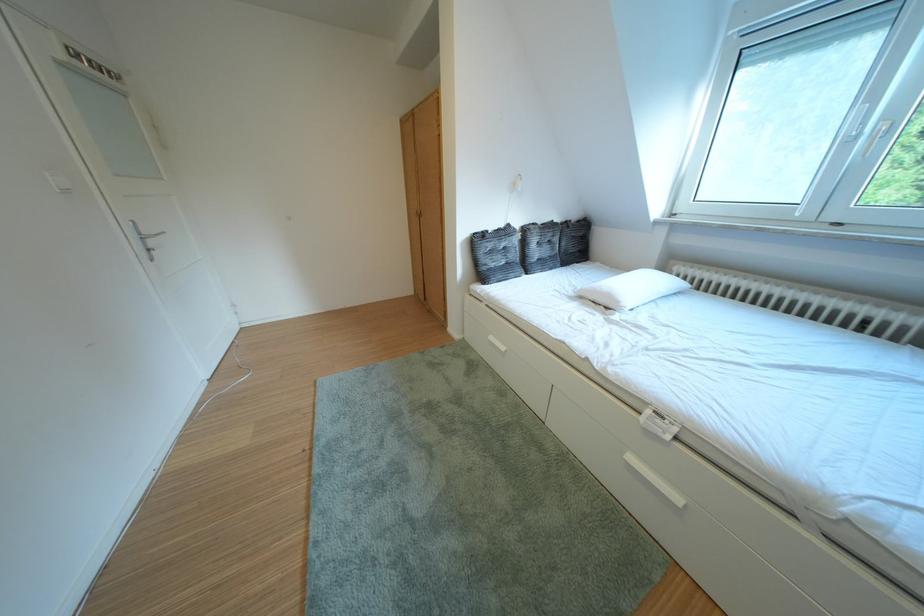
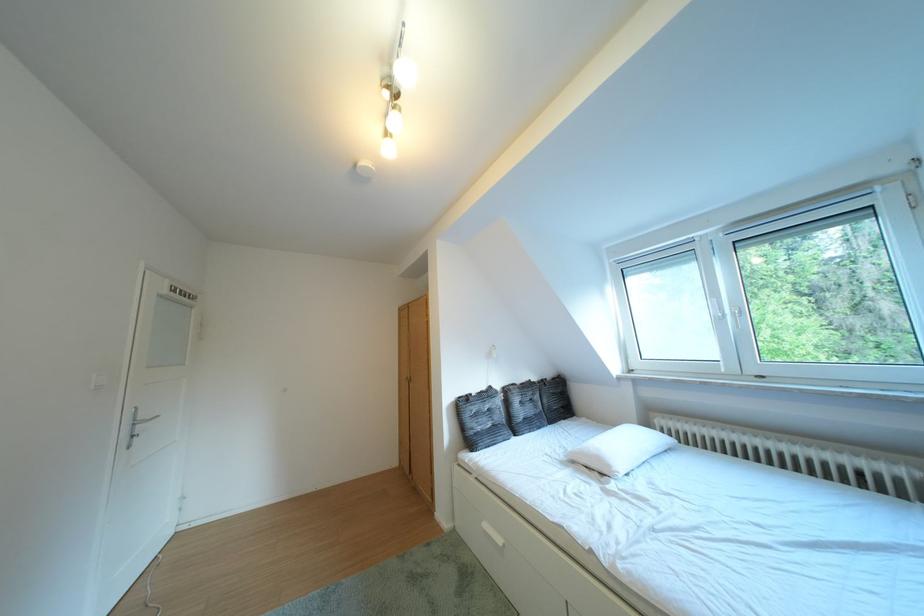
Where in the second image is the point corresponding to the point at 497,273 from the first image?

(484, 438)